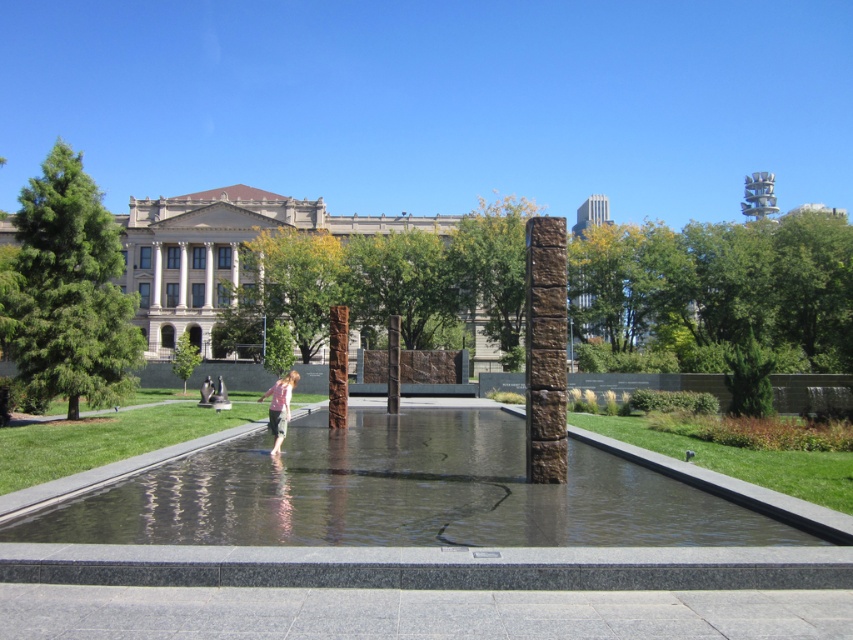
Question: Which of the following is the closest to the observer?

Choices:
 (A) (273, 401)
 (B) (537, 342)
 (C) (126, 392)

Answer: (B)

Question: Which object is closer to the camera taking this photo?

Choices:
 (A) pink fabric person at center
 (B) brown stone pillar at center

Answer: (B)

Question: Does brown stone pillar at center come in front of green leafy tree at center?

Choices:
 (A) yes
 (B) no

Answer: (A)

Question: Does green glossy tree at left appear over pink fabric person at center?

Choices:
 (A) no
 (B) yes

Answer: (B)

Question: Is clear glass water at center wider than green glossy tree at left?

Choices:
 (A) no
 (B) yes

Answer: (B)

Question: Which point is farther from the camera taking this photo?

Choices:
 (A) (540, 308)
 (B) (511, 477)
 (C) (90, 392)
 (D) (183, 358)

Answer: (D)